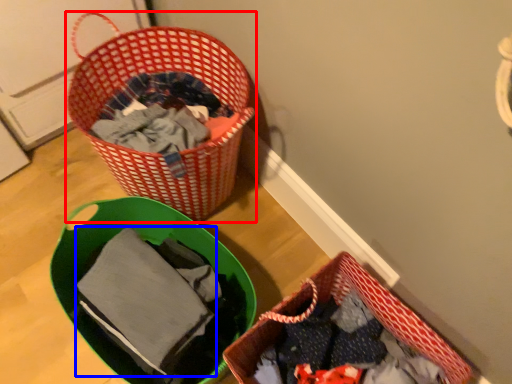
Question: Which of the following is the farthest to the observer, picnic basket (highlighted by a red box) or baby clothe (highlighted by a blue box)?

Choices:
 (A) picnic basket
 (B) baby clothe

Answer: (A)